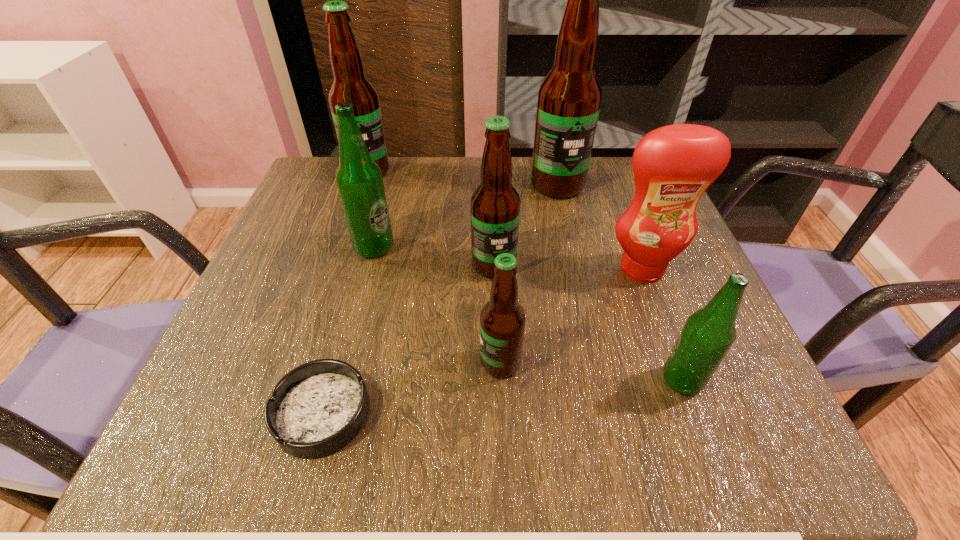
This screenshot has height=540, width=960. I want to click on the biggest brown beer bottle, so click(569, 98).

You are a GUI agent. You are given a task and a screenshot of the screen. Output one action in this format:
    pyautogui.click(x=<x>, y=<y>)
    Task: Click on the tallest beer bottle
    
    Given the screenshot: What is the action you would take?
    pyautogui.click(x=569, y=98)

Where is `the second tallest beer bottle`? The height and width of the screenshot is (540, 960). the second tallest beer bottle is located at coordinates (350, 85).

Locate an element on the screen. the second tallest object is located at coordinates (350, 85).

The image size is (960, 540). In order to click on the farther green beer bottle in this screenshot , I will do `click(359, 179)`.

I want to click on the left green beer bottle, so click(x=359, y=179).

Locate an element on the screen. the third farthest brown beer bottle is located at coordinates (495, 204).

Where is `condiment`? The image size is (960, 540). condiment is located at coordinates (673, 166).

You are a GUI agent. You are given a task and a screenshot of the screen. Output one action in this format:
    pyautogui.click(x=<x>, y=<y>)
    Task: Click on the smallest brown beer bottle
    The image size is (960, 540).
    Given the screenshot: What is the action you would take?
    pyautogui.click(x=502, y=320)

You are a GUI agent. You are given a task and a screenshot of the screen. Output one action in this format:
    pyautogui.click(x=<x>, y=<y>)
    Task: Click on the nearer green beer bottle
    This screenshot has height=540, width=960.
    Given the screenshot: What is the action you would take?
    pyautogui.click(x=708, y=334)